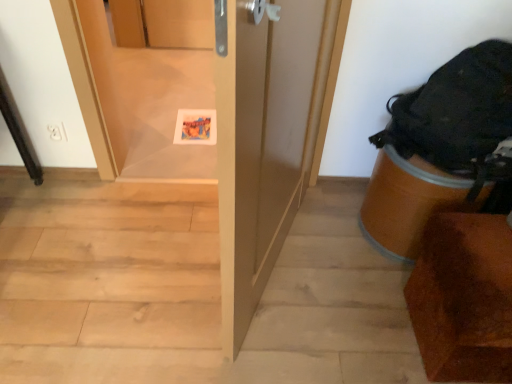
Question: Can you confirm if light wood stairwell at center is taller than matte paper postcard at center?

Choices:
 (A) yes
 (B) no

Answer: (A)

Question: Is the depth of light wood stairwell at center greater than that of matte paper postcard at center?

Choices:
 (A) yes
 (B) no

Answer: (B)

Question: Is light wood stairwell at center thinner than matte paper postcard at center?

Choices:
 (A) yes
 (B) no

Answer: (B)

Question: Considering the relative sizes of light wood stairwell at center and matte paper postcard at center in the image provided, is light wood stairwell at center smaller than matte paper postcard at center?

Choices:
 (A) no
 (B) yes

Answer: (A)

Question: Is light wood stairwell at center with matte paper postcard at center?

Choices:
 (A) yes
 (B) no

Answer: (B)

Question: Does light wood stairwell at center come in front of matte paper postcard at center?

Choices:
 (A) no
 (B) yes

Answer: (B)

Question: Considering the relative sizes of light wood stairwell at center and brown wood chair at lower right in the image provided, is light wood stairwell at center bigger than brown wood chair at lower right?

Choices:
 (A) yes
 (B) no

Answer: (B)

Question: From a real-world perspective, does light wood stairwell at center sit lower than brown wood chair at lower right?

Choices:
 (A) yes
 (B) no

Answer: (A)

Question: Is light wood stairwell at center aimed at brown wood chair at lower right?

Choices:
 (A) yes
 (B) no

Answer: (B)

Question: Considering the relative sizes of light wood stairwell at center and brown wood chair at lower right in the image provided, is light wood stairwell at center taller than brown wood chair at lower right?

Choices:
 (A) no
 (B) yes

Answer: (A)

Question: From the image's perspective, does light wood stairwell at center appear lower than brown wood chair at lower right?

Choices:
 (A) no
 (B) yes

Answer: (A)

Question: From a real-world perspective, is light wood stairwell at center on top of brown wood chair at lower right?

Choices:
 (A) yes
 (B) no

Answer: (B)

Question: Is matte paper postcard at center next to transparent plastic screen door at center and touching it?

Choices:
 (A) no
 (B) yes

Answer: (A)